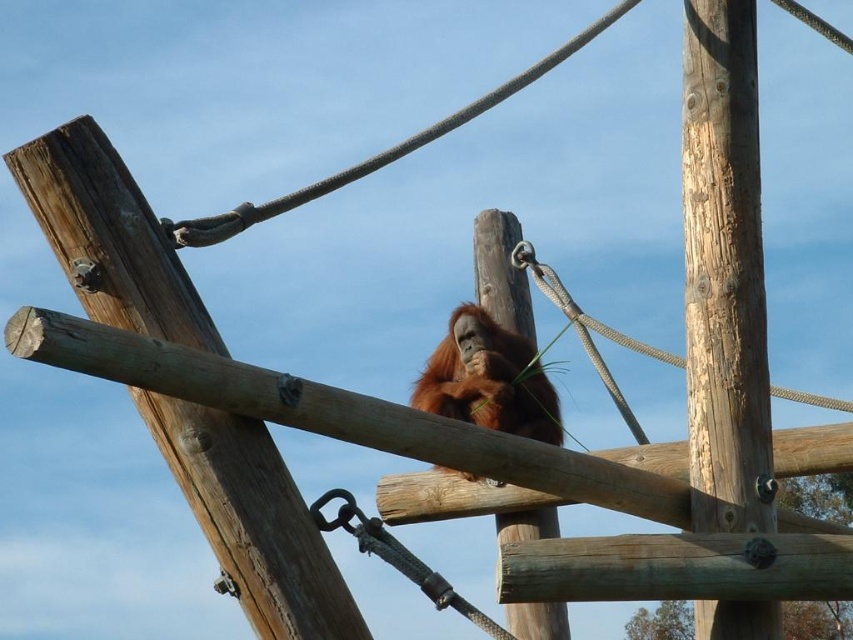
Question: Which object is closer to the camera taking this photo?

Choices:
 (A) rustic wood pole at center
 (B) orange fur orangutan at center
 (C) weathered wood pole at center
 (D) smooth wood pole at center

Answer: (A)

Question: Which of the following is the farthest from the observer?

Choices:
 (A) pos(86,195)
 (B) pos(490,353)
 (C) pos(527,339)

Answer: (C)

Question: Is orange fur orangutan at center further to the viewer compared to smooth wood pole at center?

Choices:
 (A) yes
 (B) no

Answer: (A)

Question: Does orange fur orangutan at center appear under smooth wood pole at center?

Choices:
 (A) yes
 (B) no

Answer: (A)

Question: Observing the image, what is the correct spatial positioning of weathered wood pole at center in reference to smooth wood pole at center?

Choices:
 (A) right
 (B) left

Answer: (A)

Question: Among these points, which one is farthest from the camera?

Choices:
 (A) pos(128,280)
 (B) pos(727,108)
 (C) pos(463,339)
 (D) pos(547,508)

Answer: (D)